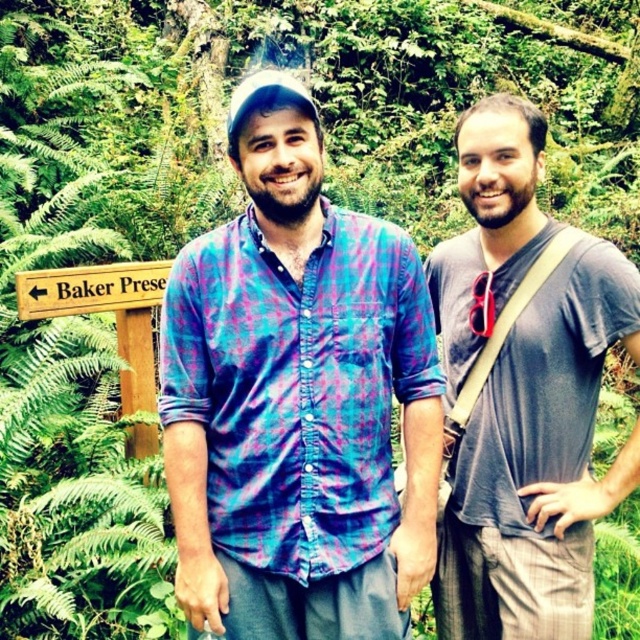
Question: Can you confirm if plaid fabric shirt at center is thinner than wooden sign at left?

Choices:
 (A) no
 (B) yes

Answer: (A)

Question: Does plaid fabric shirt at center have a lesser width compared to wooden sign at left?

Choices:
 (A) no
 (B) yes

Answer: (A)

Question: Which of the following is the closest to the observer?

Choices:
 (A) (230, 497)
 (B) (524, 100)

Answer: (A)

Question: Which object is the farthest from the plaid fabric shirt at center?

Choices:
 (A) wooden sign at left
 (B) gray cotton t-shirt at right

Answer: (A)

Question: Which is farther from the plaid fabric shirt at center?

Choices:
 (A) wooden sign at left
 (B) gray cotton t-shirt at right

Answer: (A)

Question: Is plaid fabric shirt at center below gray cotton t-shirt at right?

Choices:
 (A) no
 (B) yes

Answer: (A)